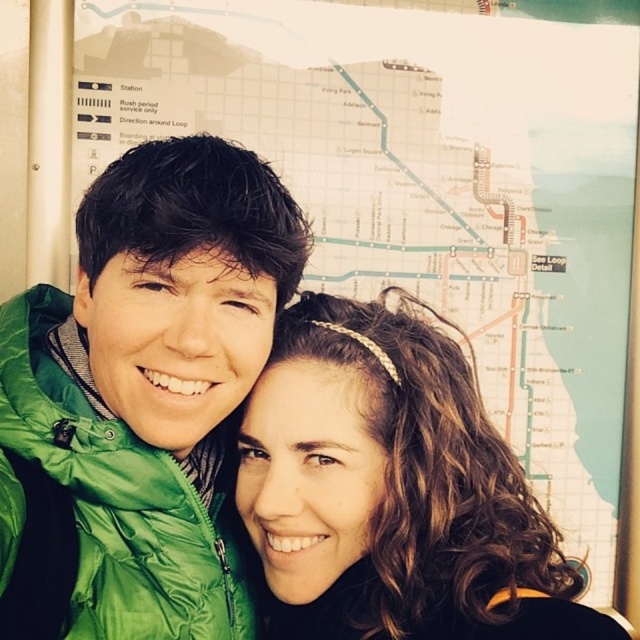
Is green puffy jacket at left to the left of brown curly hair at center from the viewer's perspective?

Indeed, green puffy jacket at left is positioned on the left side of brown curly hair at center.

How far apart are green puffy jacket at left and brown curly hair at center?

green puffy jacket at left and brown curly hair at center are 8.35 inches apart.

Does point (234, 403) come farther from viewer compared to point (561, 634)?

Yes, point (234, 403) is farther from viewer.

Locate an element on the screen. The height and width of the screenshot is (640, 640). green puffy jacket at left is located at coordinates (140, 397).